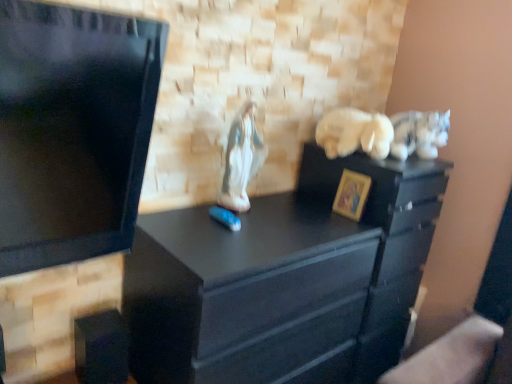
Question: From a real-world perspective, is white plush cat at upper right, arranged as the third animal when viewed from the left, located beneath porcelain statue at center, which is the 3th animal in right-to-left order?

Choices:
 (A) no
 (B) yes

Answer: (A)

Question: From the image's perspective, is white plush cat at upper right, arranged as the third animal when viewed from the left, under porcelain statue at center, the first animal viewed from the left?

Choices:
 (A) yes
 (B) no

Answer: (B)

Question: Is white plush cat at upper right, arranged as the third animal when viewed from the left, far away from porcelain statue at center, the first animal viewed from the left?

Choices:
 (A) no
 (B) yes

Answer: (A)

Question: Is white plush cat at upper right, which is the first animal from right to left, taller than porcelain statue at center, which is the 3th animal in right-to-left order?

Choices:
 (A) no
 (B) yes

Answer: (A)

Question: Is white plush cat at upper right, which is the first animal from right to left, thinner than porcelain statue at center, which is the 3th animal in right-to-left order?

Choices:
 (A) yes
 (B) no

Answer: (B)

Question: Would you say black matte chest of drawers at center is to the left or to the right of porcelain statue at center, the first animal viewed from the left, in the picture?

Choices:
 (A) right
 (B) left

Answer: (B)

Question: From a real-world perspective, is black matte chest of drawers at center above or below porcelain statue at center, which is the 3th animal in right-to-left order?

Choices:
 (A) above
 (B) below

Answer: (B)

Question: Is black matte chest of drawers at center in front of or behind porcelain statue at center, the first animal viewed from the left, in the image?

Choices:
 (A) front
 (B) behind

Answer: (A)

Question: From the image's perspective, is black matte chest of drawers at center positioned above or below porcelain statue at center, the first animal viewed from the left?

Choices:
 (A) below
 (B) above

Answer: (A)

Question: Considering the positions of black matte chest of drawers at center and gold painted wood picture frame at center right in the image, is black matte chest of drawers at center bigger or smaller than gold painted wood picture frame at center right?

Choices:
 (A) small
 (B) big

Answer: (B)

Question: Is point (270, 296) closer or farther from the camera than point (332, 206)?

Choices:
 (A) closer
 (B) farther

Answer: (A)

Question: Which is correct: black matte chest of drawers at center is inside gold painted wood picture frame at center right, or outside of it?

Choices:
 (A) outside
 (B) inside

Answer: (A)

Question: From a real-world perspective, is black matte chest of drawers at center above or below gold painted wood picture frame at center right?

Choices:
 (A) below
 (B) above

Answer: (A)

Question: Is porcelain statue at center, which is the 3th animal in right-to-left order, inside the boundaries of black matte file cabinet at center, or outside?

Choices:
 (A) inside
 (B) outside

Answer: (B)

Question: Is porcelain statue at center, the first animal viewed from the left, wider or thinner than black matte file cabinet at center?

Choices:
 (A) thin
 (B) wide

Answer: (A)